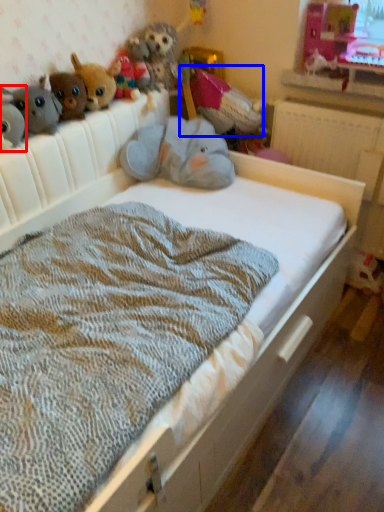
Question: Which object appears closest to the camera in this image, toy (highlighted by a red box) or toy (highlighted by a blue box)?

Choices:
 (A) toy
 (B) toy

Answer: (A)